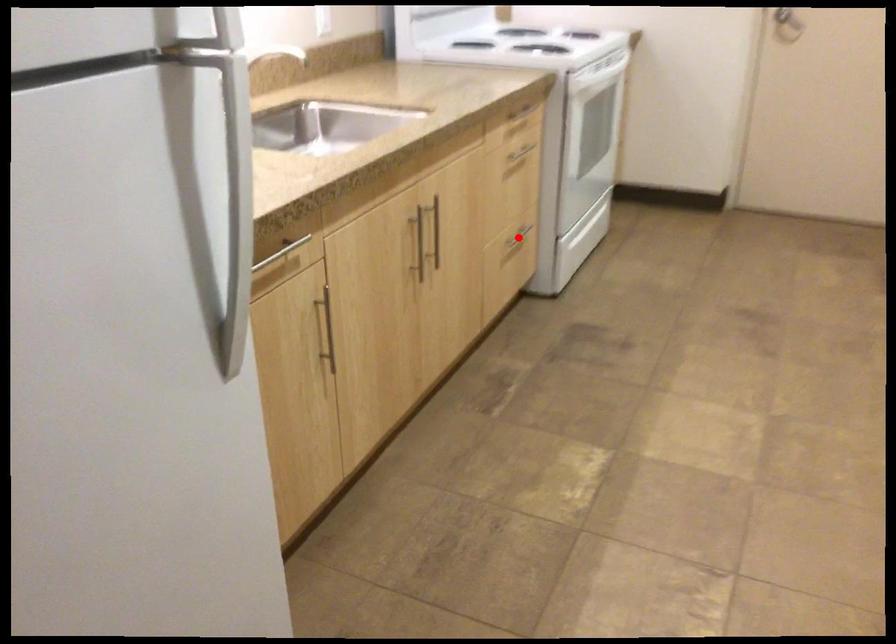
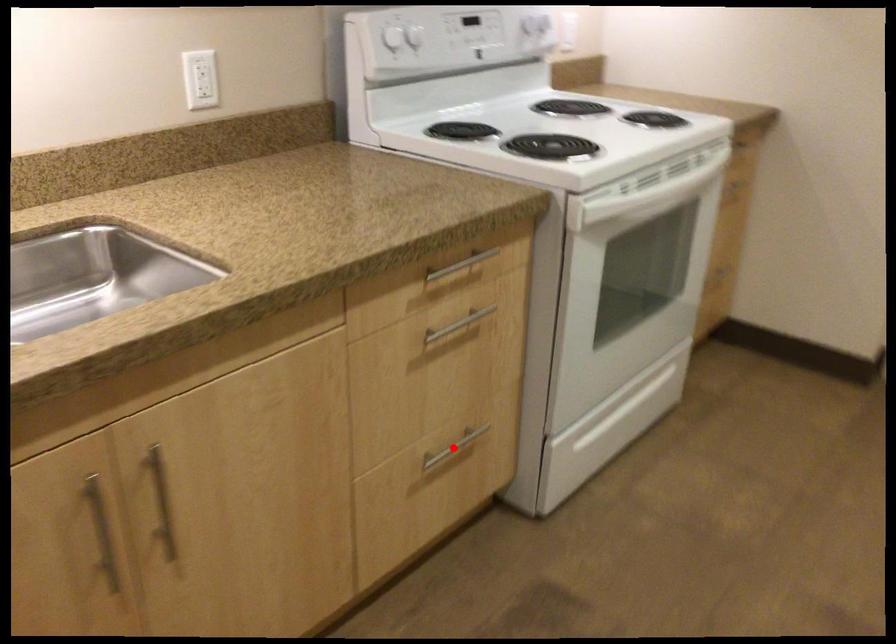
I am providing you with two images of the same scene from different viewpoints. A red point is marked on the first image and another point is marked on the second image. Are the points marked in image1 and image2 representing the same 3D position?

Yes